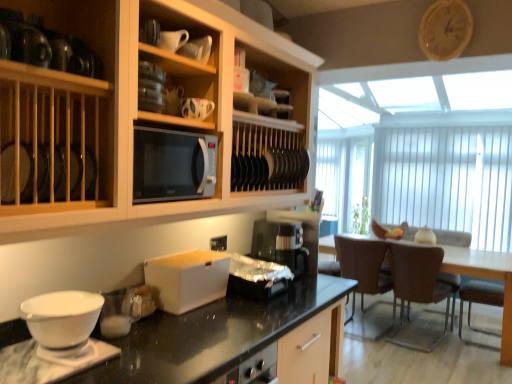
Question: Visually, is matte ceramic mug at upper center, arranged as the 2th tableware when viewed from the front, positioned to the left or to the right of brown leather chair at right, placed as the second chair when sorted from left to right?

Choices:
 (A) left
 (B) right

Answer: (A)

Question: From a real-world perspective, is matte ceramic mug at upper center, arranged as the 2th tableware when viewed from the front, above or below brown leather chair at right, which appears as the 1th chair when viewed from the right?

Choices:
 (A) above
 (B) below

Answer: (A)

Question: Which object is positioned farthest from the brown leather chair at right, which appears as the 1th chair when viewed from the right?

Choices:
 (A) black plastic coffee maker at center
 (B) shiny metallic container at center
 (C) brown leather armchair at lower right, the 1th armchair positioned from the front
 (D) satin silver microwave at center
 (E) white matte box at center

Answer: (D)

Question: Which is nearer to the white matte bowl at lower left?

Choices:
 (A) shiny metallic container at center
 (B) brown leather armchair at lower right, positioned as the second armchair in back-to-front order
 (C) wooden clock at upper right
 (D) brown leather armchair at right, which ranks as the second armchair in front-to-back order
 (E) brown leather chair at right, the 2th chair viewed from the right

Answer: (A)